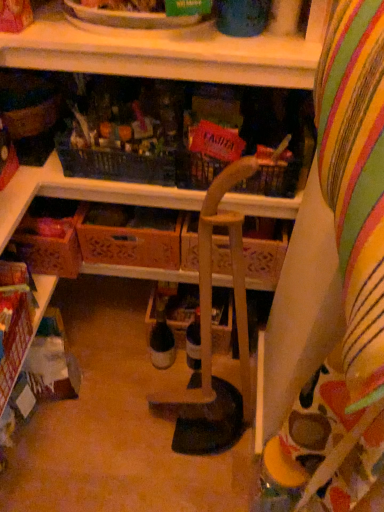
Question: Looking at the image, does wooden crate at lower left, the 2th drawer when ordered from right to left, seem bigger or smaller compared to translucent glass bottle at center?

Choices:
 (A) big
 (B) small

Answer: (A)

Question: Which is correct: wooden crate at lower left, the 2th drawer when ordered from right to left, is inside translucent glass bottle at center, or outside of it?

Choices:
 (A) outside
 (B) inside

Answer: (A)

Question: Considering the real-world distances, which object is closest to the wooden crate at lower left, marked as the second shelf in a top-to-bottom arrangement?

Choices:
 (A) wooden crate at center, positioned as the first drawer in right-to-left order
 (B) translucent glass bottle at center
 (C) wooden crate at lower left, the 2th drawer when ordered from right to left
 (D) wooden at upper center, the first shelf viewed from the right
 (E) wooden chair at center

Answer: (C)

Question: Estimate the real-world distances between objects in this image. Which object is closer to the translucent glass bottle at center?

Choices:
 (A) wooden crate at lower left, acting as the first drawer starting from the left
 (B) wooden crate at lower left, which is counted as the second shelf, starting from the right
 (C) wooden chair at center
 (D) wooden crate at center, marked as the 2th drawer in a left-to-right arrangement
 (E) wooden at upper center, the first shelf viewed from the right

Answer: (C)